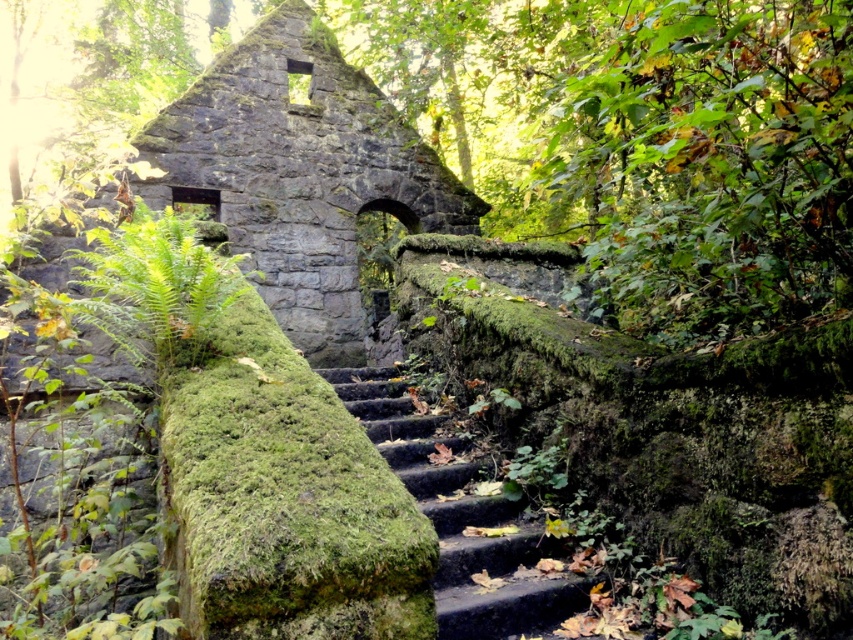
Measure the distance between point (422, 186) and camera.

9.61 meters

Where is `rusty stone ruins at center`? The image size is (853, 640). rusty stone ruins at center is located at coordinates (299, 173).

Is rusty stone ruins at center behind green mossy fern at center?

That is True.

Can you confirm if rusty stone ruins at center is thinner than green mossy fern at center?

In fact, rusty stone ruins at center might be wider than green mossy fern at center.

Where is `rusty stone ruins at center`? This screenshot has height=640, width=853. rusty stone ruins at center is located at coordinates (299, 173).

In the scene shown: Does moss-covered stone stairs at center appear under green mossy fern at center?

Yes.

Between moss-covered stone stairs at center and green mossy fern at center, which one is positioned lower?

moss-covered stone stairs at center is lower down.

Is point (440, 484) in front of point (82, 266)?

Yes, point (440, 484) is in front of point (82, 266).

Where is `moss-covered stone stairs at center`? moss-covered stone stairs at center is located at coordinates (462, 520).